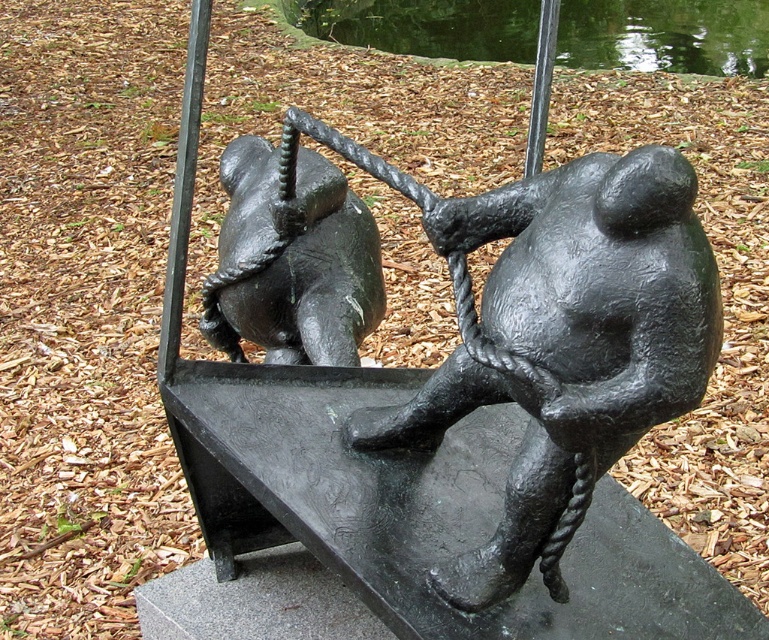
Question: Among these points, which one is farthest from the camera?

Choices:
 (A) (410, 424)
 (B) (448, 20)
 (C) (338, 308)

Answer: (B)

Question: Which point is farther to the camera?

Choices:
 (A) (514, 547)
 (B) (345, 314)

Answer: (B)

Question: Which of the following is the farthest from the observer?

Choices:
 (A) (526, 547)
 (B) (290, 22)
 (C) (355, 269)

Answer: (B)

Question: Can you confirm if black matte bear at center is wider than glossy reflective water at upper center?

Choices:
 (A) no
 (B) yes

Answer: (A)

Question: Does black matte bear at center have a smaller size compared to glossy reflective water at upper center?

Choices:
 (A) yes
 (B) no

Answer: (A)

Question: Does black matte sculpture at center appear on the right side of glossy reflective water at upper center?

Choices:
 (A) no
 (B) yes

Answer: (A)